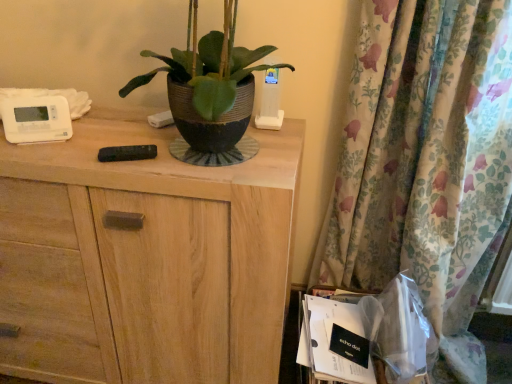
Question: From the image's perspective, is transparent plastic bag at lower right located above or below wooden cabinet at center?

Choices:
 (A) below
 (B) above

Answer: (A)

Question: Relative to wooden cabinet at center, is transparent plastic bag at lower right in front or behind?

Choices:
 (A) behind
 (B) front

Answer: (A)

Question: Considering the real-world distances, which object is closest to the white paper at lower right?

Choices:
 (A) floral fabric curtain at right
 (B) wooden cabinet at center
 (C) transparent plastic bag at lower right

Answer: (C)

Question: Based on their relative distances, which object is farther from the white paper at lower right?

Choices:
 (A) wooden cabinet at center
 (B) transparent plastic bag at lower right
 (C) floral fabric curtain at right

Answer: (A)